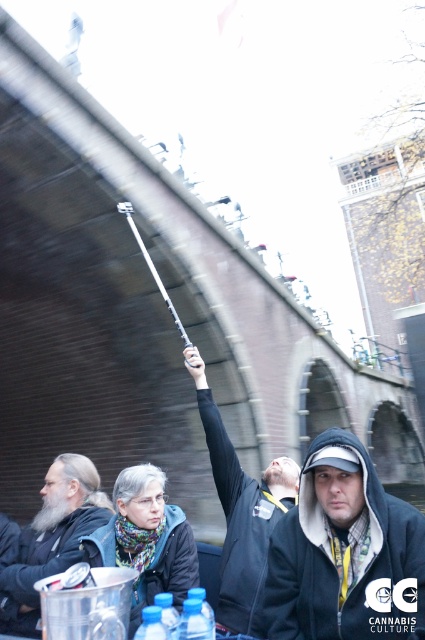
You are a photographer trying to capture a group photo. You notice the black matte jacket at upper center and the bearded man at left. Which person should you position closer to the front to ensure both are in focus?

The bearded man at left should be positioned closer to the front because the black matte jacket at upper center is taller than the bearded man at left, so adjusting their positions can help balance their sizes in the frame for better focus.